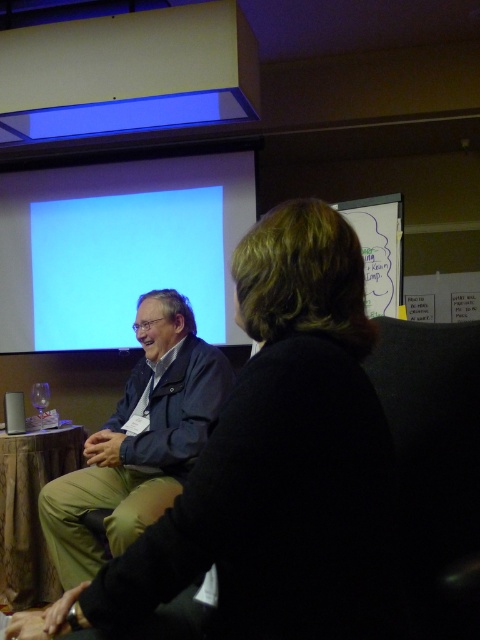
You are organizing a charity event and need to place a decorative wooden plaque on the wall. The plaque is the size of the wooden at left. Will the black fabric jacket at center fit on the plaque without overlapping the edges?

The black fabric jacket at center is smaller than wooden at left, so it can fit on the plaque without overlapping the edges.

You are an event planner setting up a presentation room. You need to ensure that the black fabric jacket at center does not block the light blue matte projection screen at upper center. Based on their sizes, can the jacket be placed in front of the screen without covering it entirely?

The black fabric jacket at center is smaller than the light blue matte projection screen at upper center, so placing it in front would leave parts of the screen visible. However, ensure the jacket doesn

You are an interior designer observing the scene. You need to place a new decorative item between the black fabric jacket at center and the wooden at left. Based on their positions, which object should the decorative item be closer to?

The black fabric jacket at center is in front of the wooden at left, so the decorative item should be placed closer to the wooden at left to maintain visual balance between the two objects.